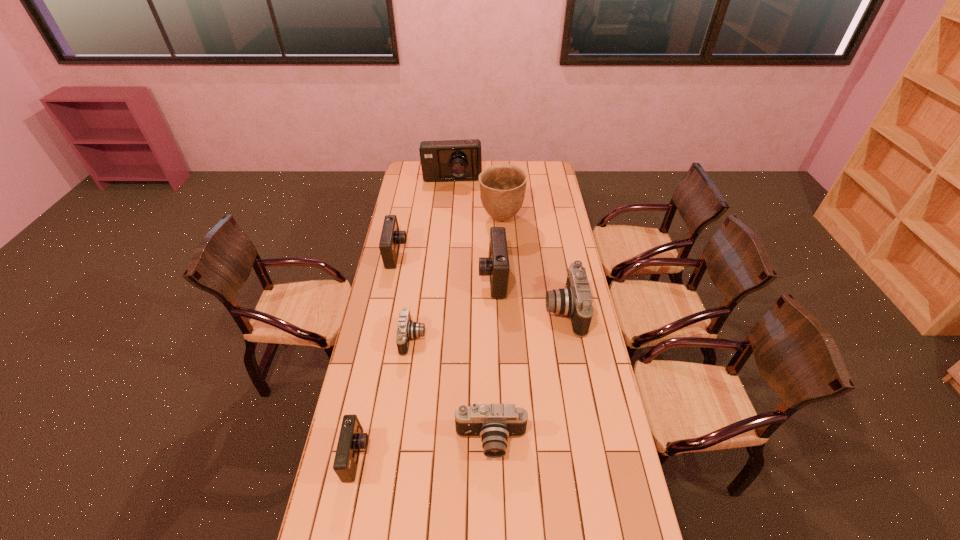
What are the coordinates of `vacant area situated on the front-facing side of the second smallest black camera` in the screenshot? It's located at (492, 529).

I want to click on vacant space located on the front-facing side of the nearest blue camera, so click(433, 456).

Identify the location of blank space located on the front-facing side of the smallest black camera. (514, 339).

What are the coordinates of `object positioned at the far edge` in the screenshot? It's located at (448, 160).

Locate an element on the screen. This screenshot has width=960, height=540. object present at the right edge is located at coordinates (575, 300).

This screenshot has width=960, height=540. Find the location of `object that is at the far left corner`. object that is at the far left corner is located at coordinates (448, 160).

The image size is (960, 540). In the image, there is a desktop. Find the location of `free space at the left edge`. free space at the left edge is located at coordinates (382, 299).

In the image, there is a desktop. Identify the location of vacant space at the right edge. click(x=550, y=199).

Image resolution: width=960 pixels, height=540 pixels. In the image, there is a desktop. In order to click on free space at the far left corner in this screenshot , I will do `click(406, 168)`.

The width and height of the screenshot is (960, 540). What are the coordinates of `free space between the smallest black camera and the nearest blue camera` in the screenshot? It's located at (385, 397).